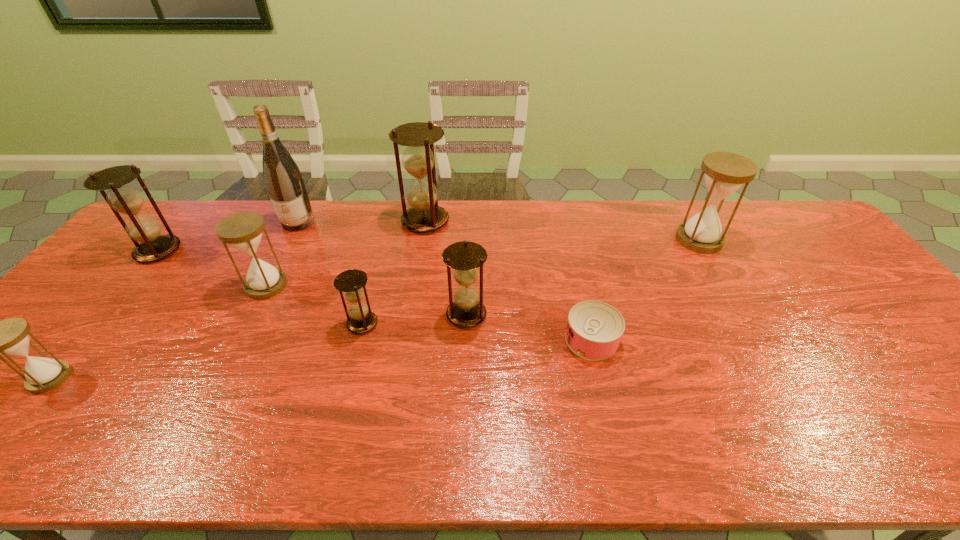
Locate an element on the screen. This screenshot has width=960, height=540. free region located 0.380m on the right of the second biggest brown hourglass is located at coordinates (301, 251).

Identify the location of vacant space located on the back of the biggest white hourglass. (681, 207).

Locate an element on the screen. The width and height of the screenshot is (960, 540). vacant area located on the back of the fifth nearest object is located at coordinates (280, 259).

The image size is (960, 540). Identify the location of vacant space situated on the back of the second hourglass from right to left. (468, 287).

What are the coordinates of `free space located on the front of the smallest brown hourglass` in the screenshot? It's located at (352, 361).

Locate an element on the screen. The height and width of the screenshot is (540, 960). vacant space positioned on the back of the smallest white hourglass is located at coordinates (144, 267).

I want to click on free region located 0.190m on the left of the shortest object, so click(x=490, y=340).

Identify the location of wine bottle that is positioned at the far edge. (284, 182).

This screenshot has height=540, width=960. Find the location of `object that is positioned at the far left corner`. object that is positioned at the far left corner is located at coordinates (122, 198).

The image size is (960, 540). In the image, there is a desktop. Identify the location of vacant area at the far edge. coord(338,241).